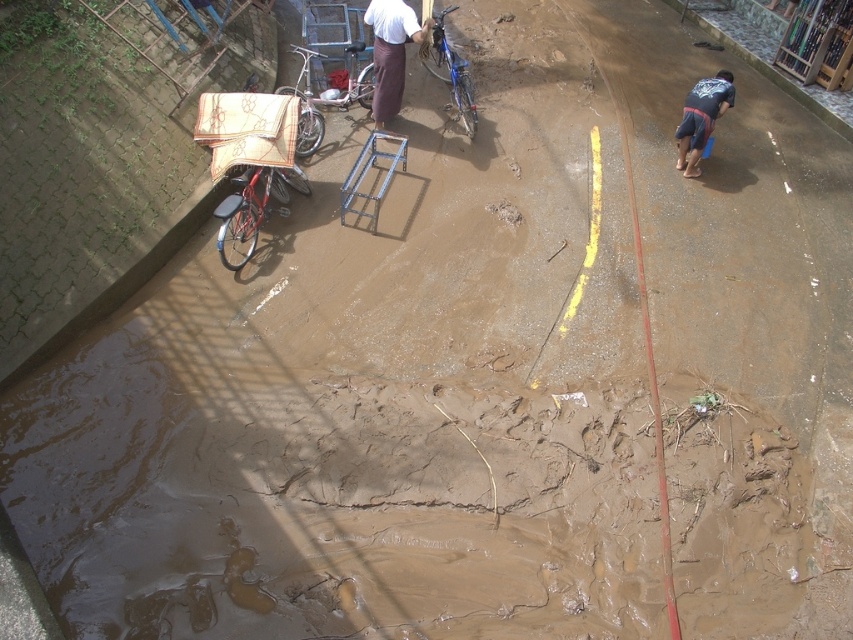
You are a delivery person trying to navigate through the muddy street. You see a white fabric at center and a blue metallic bicycle at center. Which object is closer to you as you approach the scene?

The white fabric at center is in front of the blue metallic bicycle at center, so it is closer to you as you approach the scene.

You are standing at the point with coordinates (x=392, y=52) in the muddy street scene. What object is located exactly at your current position?

The point at coordinates (x=392, y=52) indicates a white fabric at center, so the object at that location is the white fabric at center.

You are navigating a muddy street with two points marked as point 1 at coordinates (387, 100) and point 2 at coordinates (728, 81). If you are facing the direction of point 2, which point is located behind you?

Point 1 at coordinates (387, 100) is behind point 2 at coordinates (728, 81). Since you are facing point 2, the point behind you would be point 1 at coordinates (387, 100).